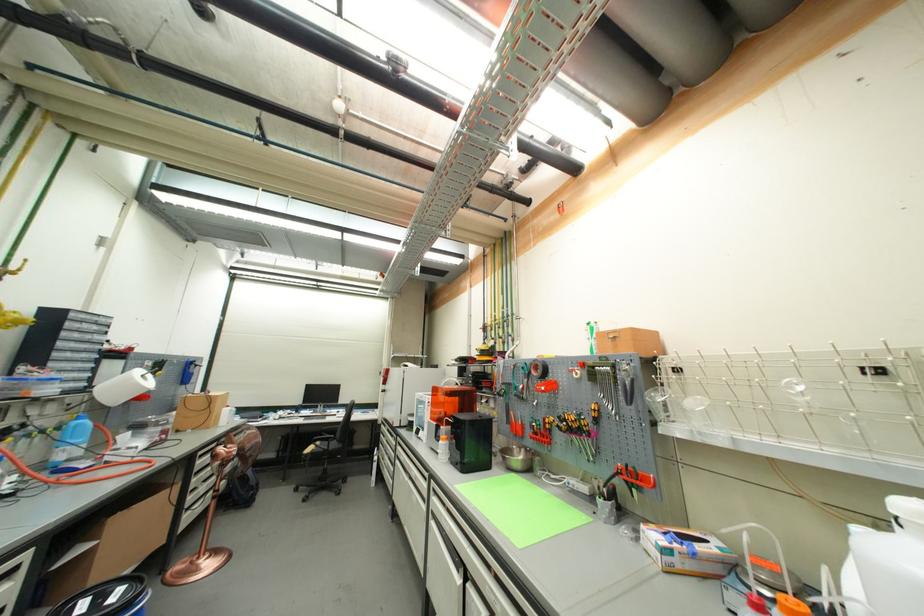
Identify the location of white jug handle. This screenshot has height=616, width=924. (886, 564).